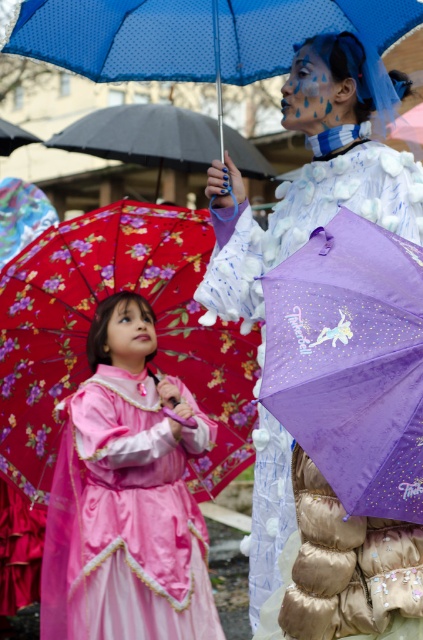
Does pink satin dress at center have a greater height compared to floral fabric umbrella at upper left?

Yes, pink satin dress at center is taller than floral fabric umbrella at upper left.

Is point (87, 340) more distant than point (11, 134)?

That is False.

The width and height of the screenshot is (423, 640). Identify the location of pink satin dress at center. (126, 497).

Does matte purple umbrella at center lie in front of floral fabric umbrella at center?

Yes, it is.

Does matte purple umbrella at center appear over floral fabric umbrella at center?

Actually, matte purple umbrella at center is below floral fabric umbrella at center.

Which is in front, point (370, 52) or point (364, 20)?

Point (370, 52)

This screenshot has height=640, width=423. In order to click on matte purple umbrella at center in this screenshot , I will do `click(313, 173)`.

From the picture: Who is positioned more to the right, pink satin dress at center or purple fabric umbrella at center?

purple fabric umbrella at center

Does pink satin dress at center appear on the right side of purple fabric umbrella at center?

Incorrect, pink satin dress at center is not on the right side of purple fabric umbrella at center.

Find the location of a particular element. This screenshot has height=640, width=423. pink satin dress at center is located at coordinates (126, 497).